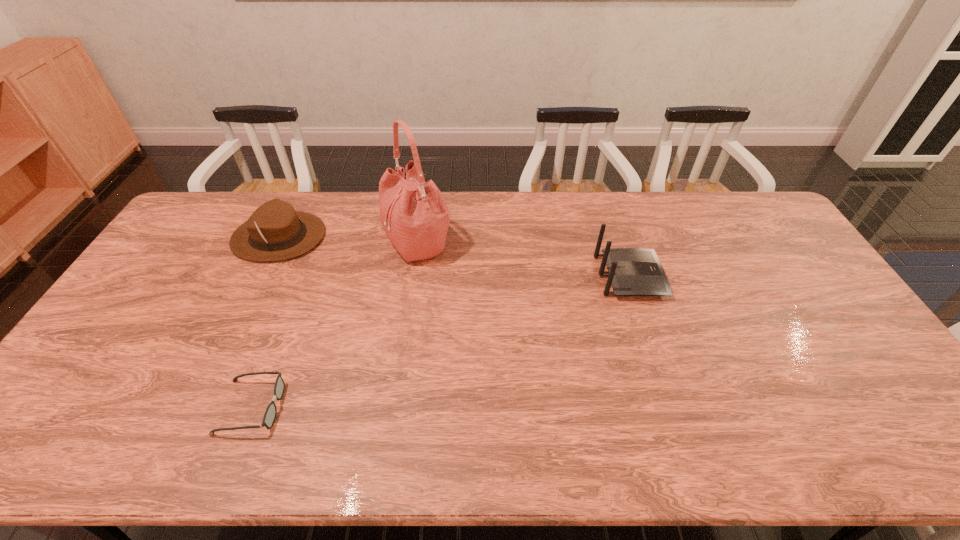
This screenshot has height=540, width=960. Identify the location of handbag located in the far edge section of the desktop. (414, 215).

In order to click on fedora that is at the far edge in this screenshot , I will do `click(275, 231)`.

Identify the location of object that is at the near edge. This screenshot has width=960, height=540. (269, 417).

In the image, there is a desktop. Identify the location of free space at the far edge. This screenshot has width=960, height=540. (455, 200).

The height and width of the screenshot is (540, 960). Find the location of `free location at the near edge`. free location at the near edge is located at coordinates (493, 438).

This screenshot has width=960, height=540. In order to click on free space at the left edge in this screenshot , I will do `click(135, 367)`.

This screenshot has width=960, height=540. I want to click on vacant space at the right edge of the desktop, so click(844, 360).

This screenshot has height=540, width=960. Identify the location of vacant area between the rightmost object and the third object from left to right. (524, 259).

Image resolution: width=960 pixels, height=540 pixels. In order to click on unoccupied area between the third object from left to right and the rightmost object in this screenshot , I will do `click(524, 259)`.

The height and width of the screenshot is (540, 960). In order to click on free spot between the tallest object and the rightmost object in this screenshot , I will do `click(524, 259)`.